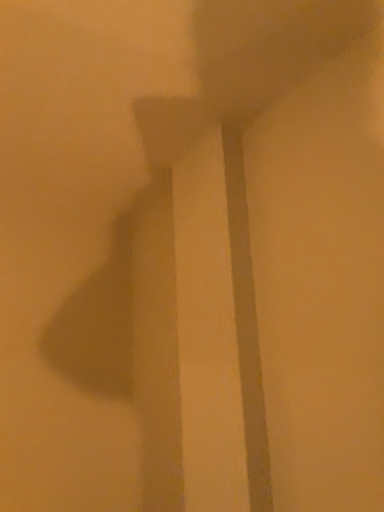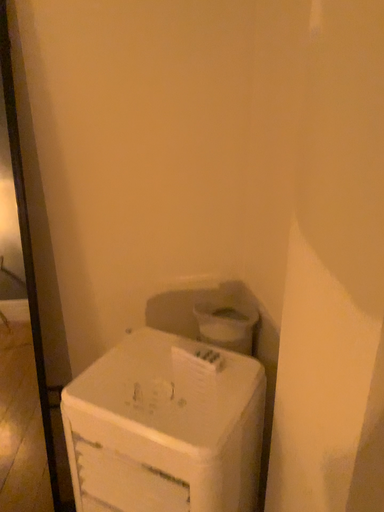
Question: Which way did the camera rotate in the video?

Choices:
 (A) rotated upward
 (B) rotated downward

Answer: (B)